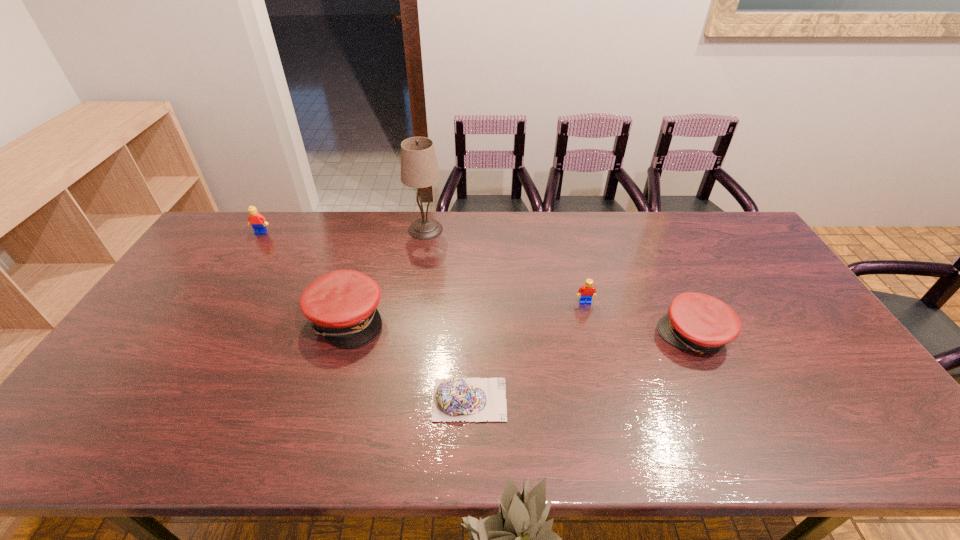
Locate an element on the screen. Image resolution: width=960 pixels, height=540 pixels. the third object from right to left is located at coordinates (472, 399).

You are a GUI agent. You are given a task and a screenshot of the screen. Output one action in this format:
    pyautogui.click(x=<x>, y=<y>)
    Task: Click on the second cap from left to right
    Image resolution: width=960 pixels, height=540 pixels.
    Given the screenshot: What is the action you would take?
    pyautogui.click(x=472, y=399)

I want to click on vacant region located 0.060m on the front-facing side of the third object from left to right, so click(x=422, y=251).

In order to click on vacant space located on the face of the left Lego in this screenshot , I will do `click(249, 252)`.

This screenshot has height=540, width=960. I want to click on vacant space located on the front-facing side of the leftmost cap, so click(485, 319).

In order to click on free space located on the front-facing side of the shorter Lego in this screenshot , I will do `click(594, 339)`.

This screenshot has height=540, width=960. What are the coordinates of `vacant area situated 0.060m on the front of the second shortest cap with an emblem` in the screenshot? It's located at (637, 336).

I want to click on free space located 0.070m on the front of the second shortest cap with an emblem, so click(x=634, y=336).

Find the location of a particular element. free region located on the front of the second shortest cap with an emblem is located at coordinates (551, 336).

Identify the location of vacant area situated on the front, side, and top of the shortest object. Image resolution: width=960 pixels, height=540 pixels. (610, 400).